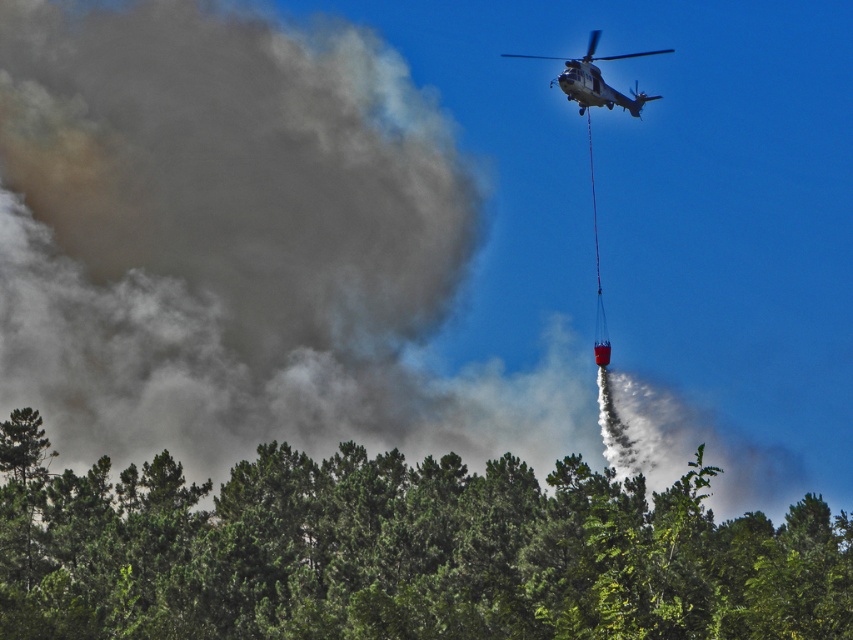
Question: Is green leafy trees at lower center below metallic gray helicopter at upper center?

Choices:
 (A) no
 (B) yes

Answer: (B)

Question: Does green leafy trees at lower center appear under metallic gray helicopter at upper center?

Choices:
 (A) yes
 (B) no

Answer: (A)

Question: Which object is closer to the camera taking this photo?

Choices:
 (A) metallic gray helicopter at upper center
 (B) green leafy trees at lower center

Answer: (B)

Question: Among these points, which one is nearest to the camera?

Choices:
 (A) (595, 44)
 (B) (805, 618)

Answer: (B)

Question: Does green leafy trees at lower center appear under metallic gray helicopter at upper center?

Choices:
 (A) no
 (B) yes

Answer: (B)